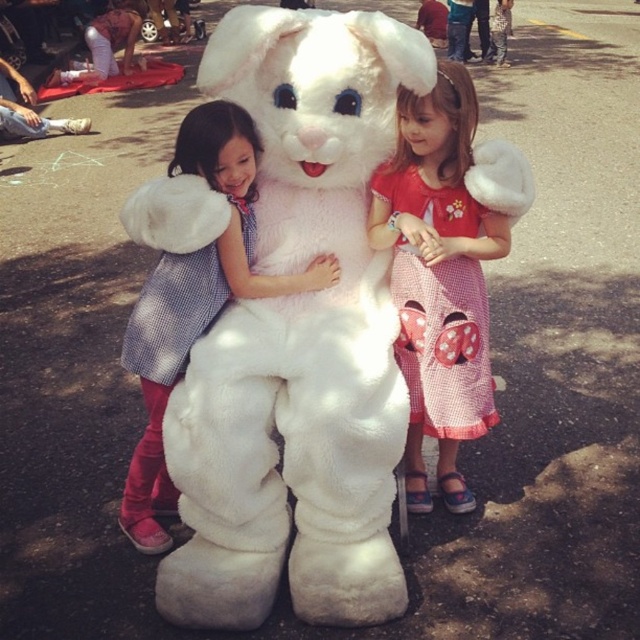
You are standing at the point marked as point (298, 339) in the image. Looking around, you see the fluffy white bunny at center. Which direction should you face to see the girl on the left hugging the bunny?

Since the point (298, 339) is where the fluffy white bunny at center is located, you are already at the bunny. To see the girl on the left hugging the bunny, you should face towards the left side of the bunny.

You are standing at the origin point in the image. The fluffy white bunny at center is located at point (x=298, y=339). If you want to move towards the fluffy white bunny at center, which direction should you move in terms of coordinates?

The fluffy white bunny at center is located at point (x=298, y=339). Since you are at the origin point, you should move towards the coordinates (x=298, y=339) to reach the fluffy white bunny at center.